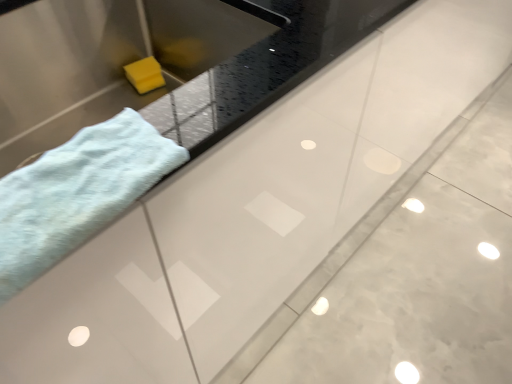
Question: Is matte stainless steel sink at left at the back of soft blue towel at left?

Choices:
 (A) yes
 (B) no

Answer: (B)

Question: Can you see soft blue towel at left touching matte stainless steel sink at left?

Choices:
 (A) yes
 (B) no

Answer: (B)

Question: Considering the relative sizes of soft blue towel at left and matte stainless steel sink at left in the image provided, is soft blue towel at left taller than matte stainless steel sink at left?

Choices:
 (A) no
 (B) yes

Answer: (A)

Question: Is soft blue towel at left at the left side of matte stainless steel sink at left?

Choices:
 (A) yes
 (B) no

Answer: (B)

Question: Is soft blue towel at left surrounding matte stainless steel sink at left?

Choices:
 (A) yes
 (B) no

Answer: (B)

Question: Considering the relative sizes of soft blue towel at left and matte stainless steel sink at left in the image provided, is soft blue towel at left thinner than matte stainless steel sink at left?

Choices:
 (A) no
 (B) yes

Answer: (B)

Question: Does matte stainless steel sink at left have a lesser width compared to soft blue towel at left?

Choices:
 (A) yes
 (B) no

Answer: (B)

Question: Is matte stainless steel sink at left next to soft blue towel at left and touching it?

Choices:
 (A) no
 (B) yes

Answer: (A)

Question: From a real-world perspective, is matte stainless steel sink at left under soft blue towel at left?

Choices:
 (A) yes
 (B) no

Answer: (A)

Question: Considering the relative sizes of matte stainless steel sink at left and soft blue towel at left in the image provided, is matte stainless steel sink at left wider than soft blue towel at left?

Choices:
 (A) yes
 (B) no

Answer: (A)

Question: Can you confirm if matte stainless steel sink at left is smaller than soft blue towel at left?

Choices:
 (A) no
 (B) yes

Answer: (A)

Question: Is matte stainless steel sink at left oriented away from soft blue towel at left?

Choices:
 (A) no
 (B) yes

Answer: (A)

Question: Would you say matte stainless steel sink at left is inside or outside soft blue towel at left?

Choices:
 (A) outside
 (B) inside

Answer: (A)